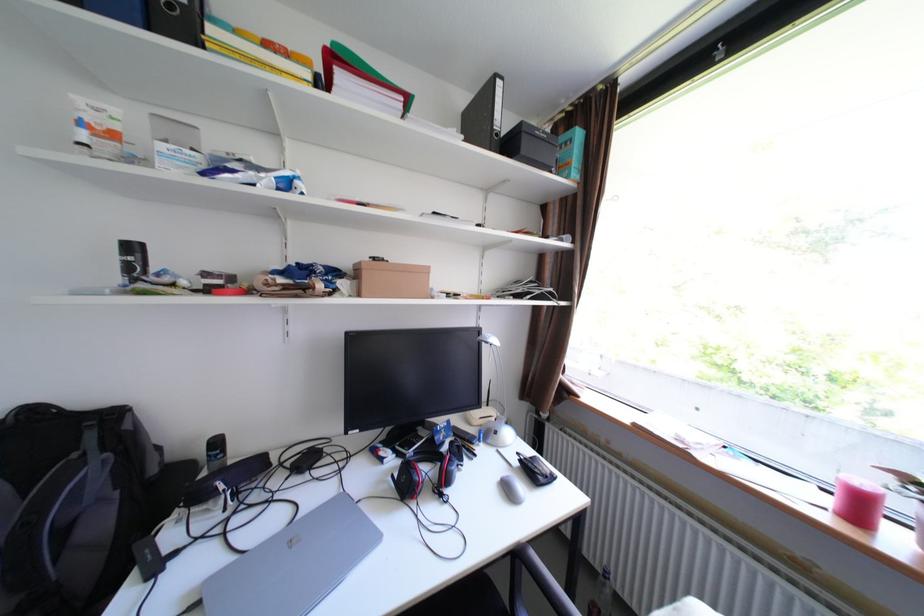
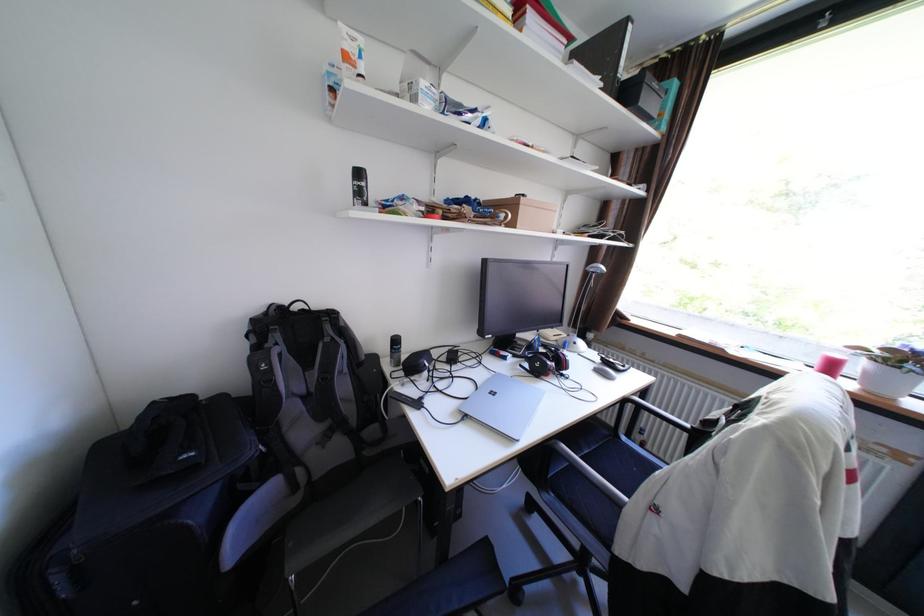
Question: The first image is from the beginning of the video and the second image is from the end. How did the camera likely rotate when shooting the video?

Choices:
 (A) Left
 (B) Right
 (C) Up
 (D) Down

Answer: (D)